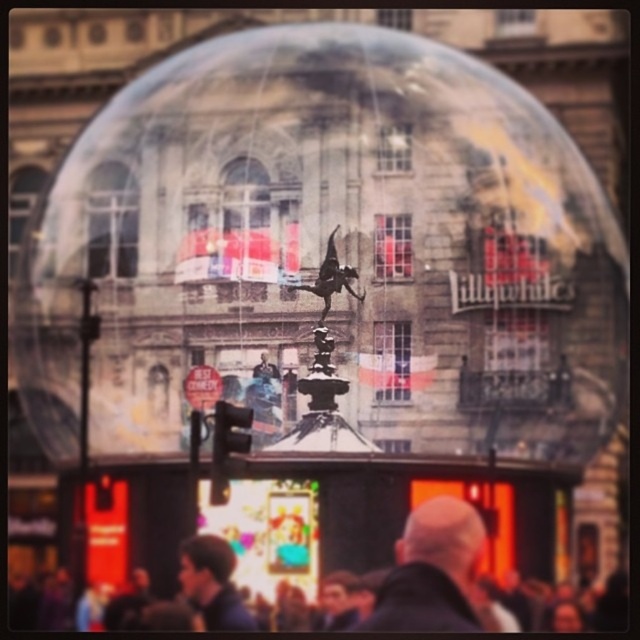
Looking at this image, you are a photographer standing in the bubble structure and want to capture both the dark gray fabric crowd at lower center and the dark blue shirt at lower center in a single photo. Which object should be closer to the camera to ensure both are in focus?

The dark gray fabric crowd at lower center is shorter than the dark blue shirt at lower center, so the dark gray fabric crowd at lower center should be closer to the camera to ensure both are in focus.

From the picture: You are standing in the bustling urban scene and want to take a photo of the dark hair bald head at center without including the transparent glass sphere at center in the frame. Which direction should you move to achieve this?

Move to the right side of the dark hair bald head at center to avoid the transparent glass sphere at center, since the transparent glass sphere at center is located to the left of it.